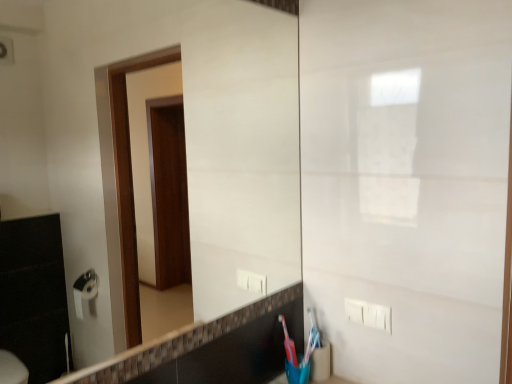
Question: In terms of height, does white plastic electric outlet at lower right look taller or shorter compared to translucent plastic toothbrush at lower right?

Choices:
 (A) tall
 (B) short

Answer: (B)

Question: From the image's perspective, relative to translucent plastic toothbrush at lower right, is white plastic electric outlet at lower right above or below?

Choices:
 (A) below
 (B) above

Answer: (B)

Question: From a real-world perspective, relative to translucent plastic toothbrush at lower right, is white plastic electric outlet at lower right vertically above or below?

Choices:
 (A) above
 (B) below

Answer: (A)

Question: Would you say translucent plastic toothbrush at lower right is inside or outside white plastic electric outlet at lower right?

Choices:
 (A) inside
 (B) outside

Answer: (B)

Question: Based on their positions, is translucent plastic toothbrush at lower right located to the left or right of white plastic electric outlet at lower right?

Choices:
 (A) left
 (B) right

Answer: (A)

Question: Based on their sizes in the image, would you say translucent plastic toothbrush at lower right is bigger or smaller than white plastic electric outlet at lower right?

Choices:
 (A) small
 (B) big

Answer: (A)

Question: From a real-world perspective, is translucent plastic toothbrush at lower right above or below white plastic electric outlet at lower right?

Choices:
 (A) above
 (B) below

Answer: (B)